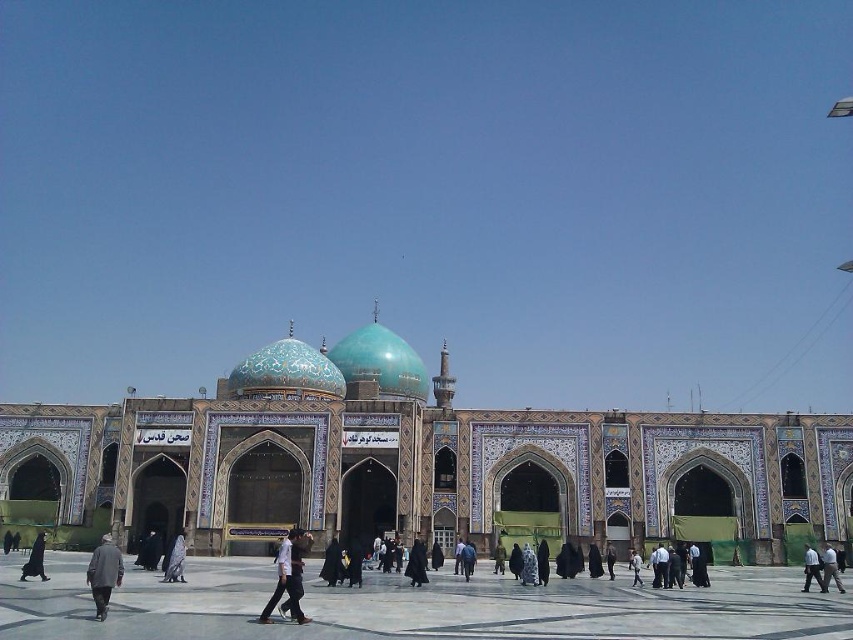
You are standing in front of the grand mosque and notice a person wearing a white matte shirt at center and a dark gray coat at lower left. Which clothing item is positioned higher relative to the other?

The white matte shirt at center is above the dark gray coat at lower left, so the white matte shirt at center is positioned higher.

You are standing at the entrance of the grand mosque and notice two points marked on the facade. The first point is located at coordinates point (287, 593) and the second at point (102, 611). From your perspective, which point is closer to you?

Point (102, 611) is closer to you because the Objects Description states that point (287, 593) is behind point (102, 611).